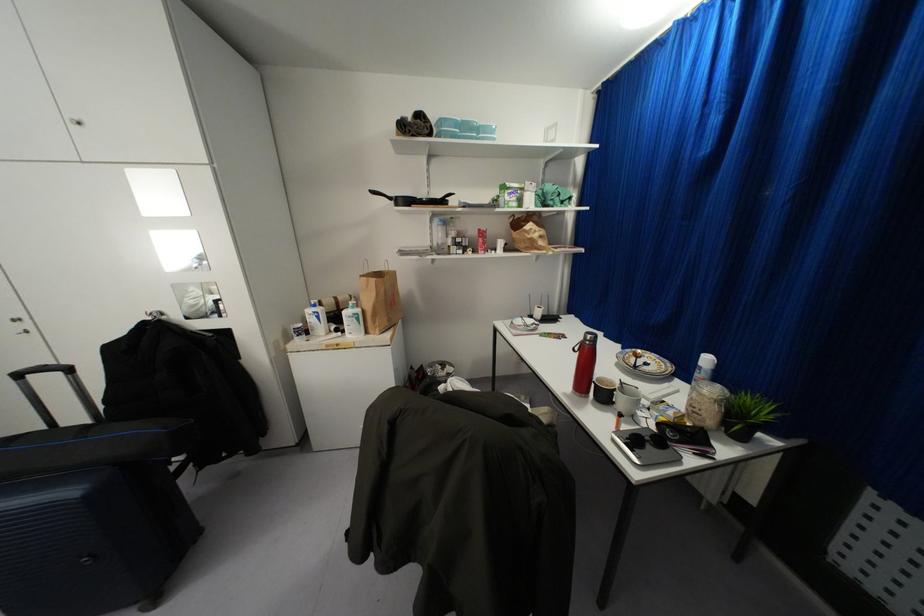
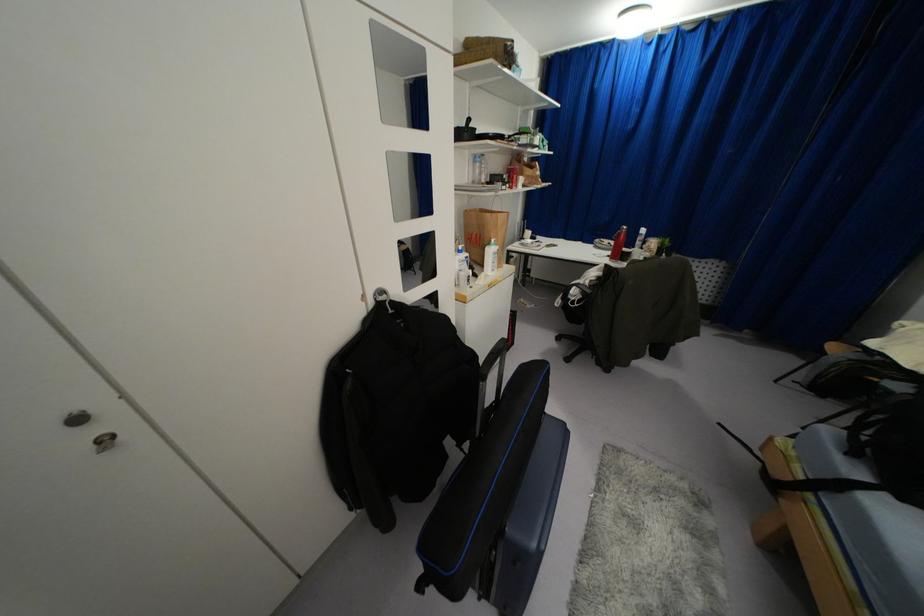
In the second image, find the point that corresponds to (358,310) in the first image.

(495, 246)